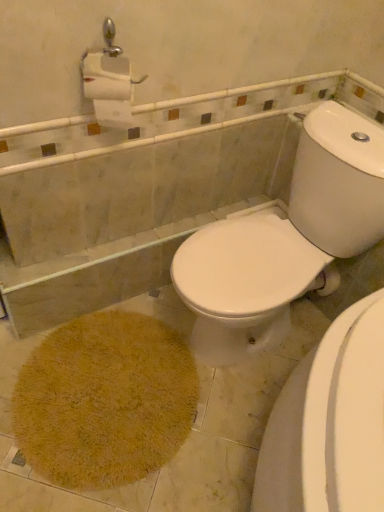
Question: From a real-world perspective, is yellow shaggy bath mat at lower left positioned above or below white glossy toilet at center?

Choices:
 (A) above
 (B) below

Answer: (B)

Question: In terms of width, does yellow shaggy bath mat at lower left look wider or thinner when compared to white glossy toilet at center?

Choices:
 (A) thin
 (B) wide

Answer: (A)

Question: Is yellow shaggy bath mat at lower left spatially inside white glossy toilet at center, or outside of it?

Choices:
 (A) inside
 (B) outside

Answer: (B)

Question: Considering the positions of white glossy toilet at center and yellow shaggy bath mat at lower left in the image, is white glossy toilet at center taller or shorter than yellow shaggy bath mat at lower left?

Choices:
 (A) short
 (B) tall

Answer: (B)

Question: In terms of width, does white glossy toilet at center look wider or thinner when compared to yellow shaggy bath mat at lower left?

Choices:
 (A) thin
 (B) wide

Answer: (B)

Question: Based on their sizes in the image, would you say white glossy toilet at center is bigger or smaller than yellow shaggy bath mat at lower left?

Choices:
 (A) small
 (B) big

Answer: (B)

Question: From the image's perspective, is white glossy toilet at center located above or below yellow shaggy bath mat at lower left?

Choices:
 (A) above
 (B) below

Answer: (A)